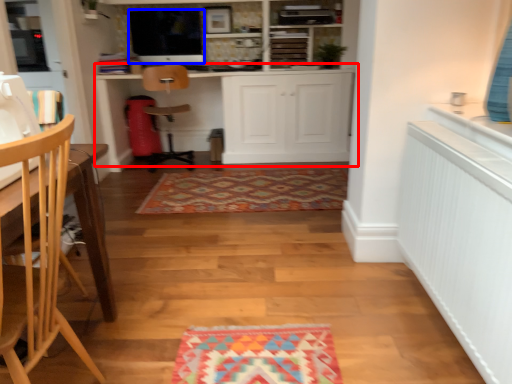
Question: Which object is closer to the camera taking this photo, cabinetry (highlighted by a red box) or appliance (highlighted by a blue box)?

Choices:
 (A) cabinetry
 (B) appliance

Answer: (A)